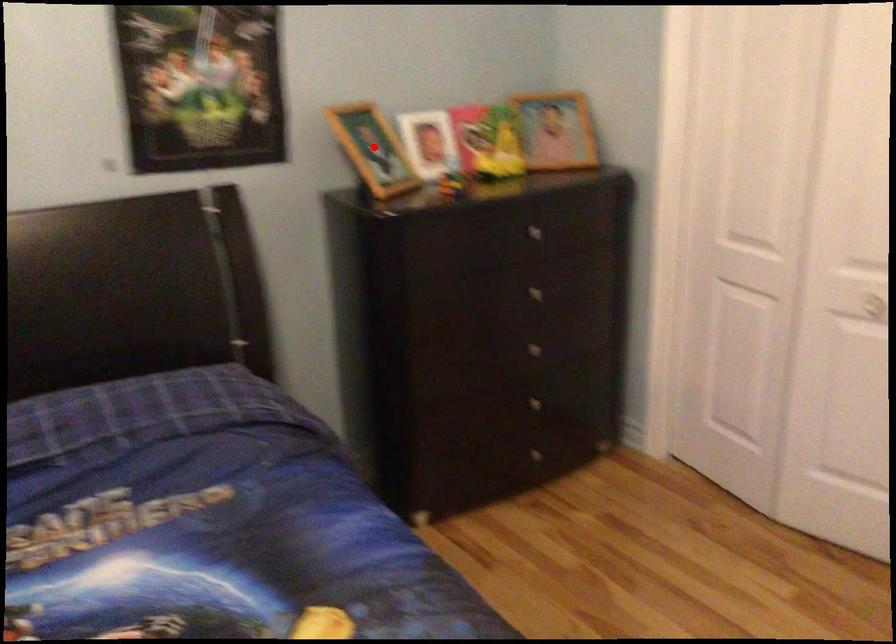
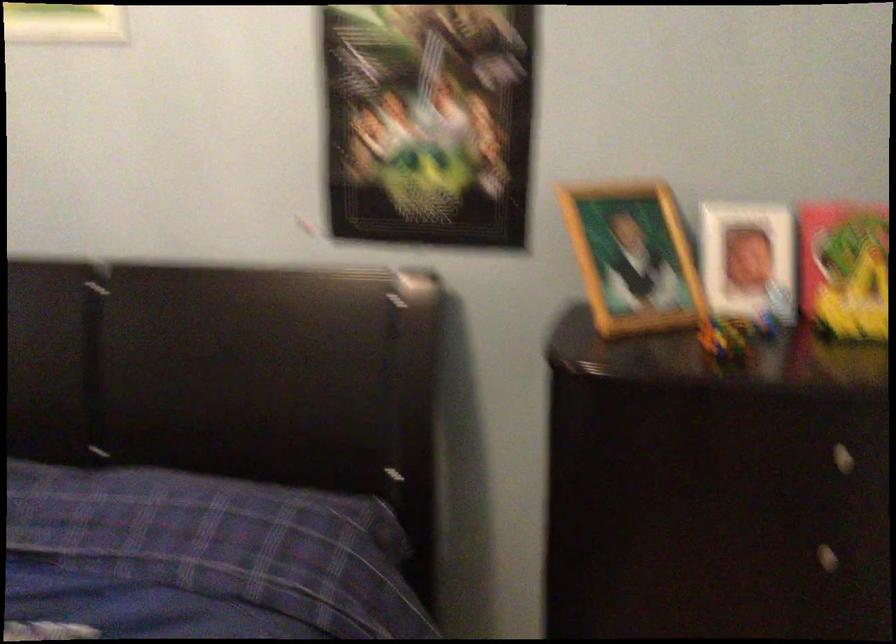
Question: I am providing you with two images of the same scene from different viewpoints. In image1, a red point is highlighted. Considering the same 3D point in image2, which of the following is correct?

Choices:
 (A) It is closer
 (B) It is farther

Answer: (A)